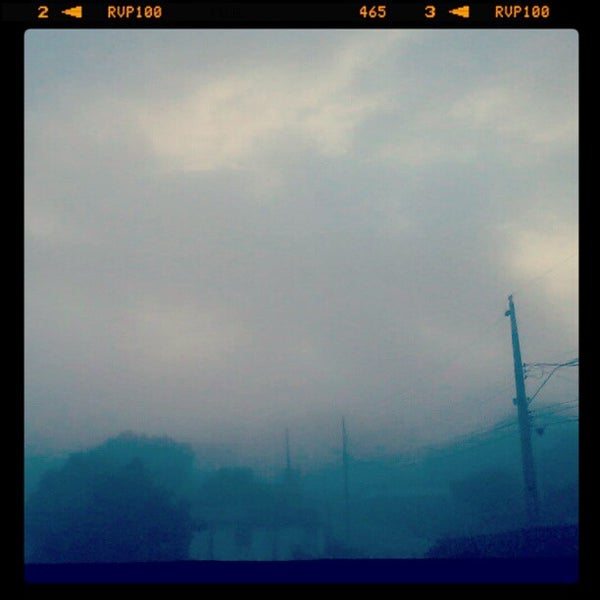
What are the coordinates of `cable` in the screenshot? It's located at (537, 278).